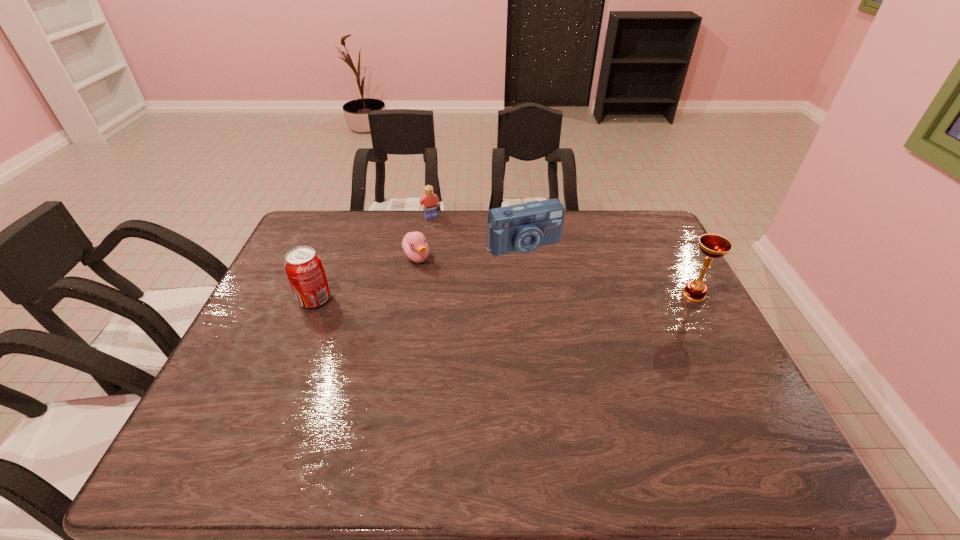
This screenshot has width=960, height=540. Find the location of `the leftmost object`. the leftmost object is located at coordinates (303, 266).

The height and width of the screenshot is (540, 960). Find the location of `chalice`. chalice is located at coordinates (713, 246).

At what (x,y) coordinates should I click in order to perform the action: click on the shortest object. Please return your answer as a coordinate pair (x, y). Looking at the image, I should click on (414, 244).

The image size is (960, 540). In order to click on Lego in this screenshot , I will do `click(430, 201)`.

Where is `the fourth object from left to right`? Image resolution: width=960 pixels, height=540 pixels. the fourth object from left to right is located at coordinates (523, 228).

At what (x,y) coordinates should I click in order to perform the action: click on free region located on the back of the leftmost object. Please return your answer as a coordinate pair (x, y). Image resolution: width=960 pixels, height=540 pixels. Looking at the image, I should click on (325, 272).

This screenshot has width=960, height=540. Find the location of `vacant space situated 0.290m on the back of the chalice`. vacant space situated 0.290m on the back of the chalice is located at coordinates (659, 228).

This screenshot has height=540, width=960. I want to click on vacant space located on the front-facing side of the duckling, so click(492, 349).

Image resolution: width=960 pixels, height=540 pixels. In order to click on vacant space located on the front-facing side of the duckling in this screenshot , I will do `click(442, 290)`.

Where is `free space located on the front-facing side of the duckling`? The height and width of the screenshot is (540, 960). free space located on the front-facing side of the duckling is located at coordinates (490, 346).